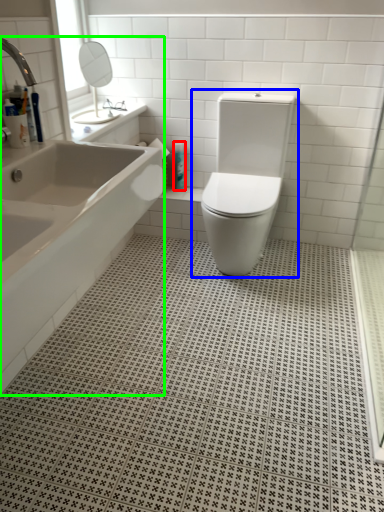
Question: Estimate the real-world distances between objects in this image. Which object is closer to toiletry (highlighted by a red box), toilet (highlighted by a blue box) or bathtub (highlighted by a green box)?

Choices:
 (A) toilet
 (B) bathtub

Answer: (A)